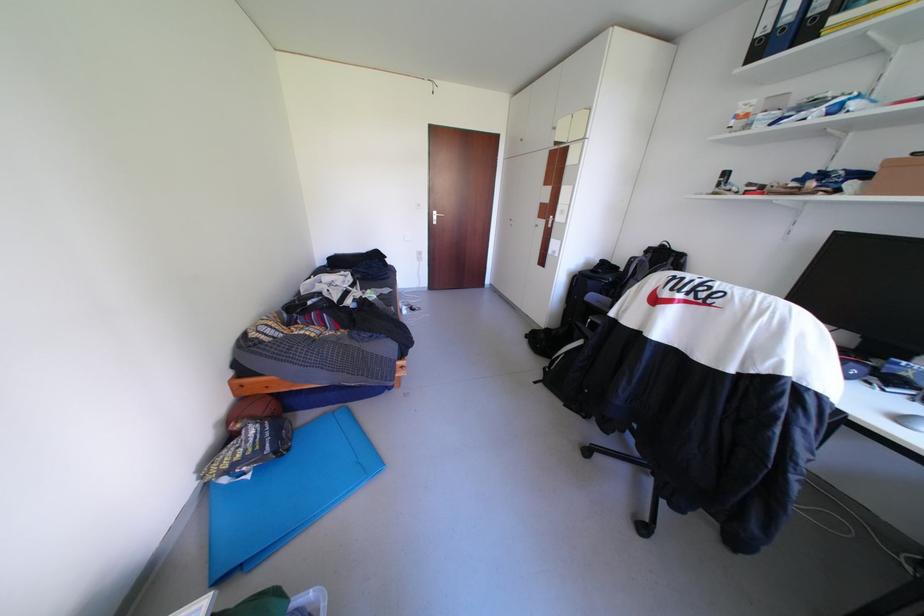
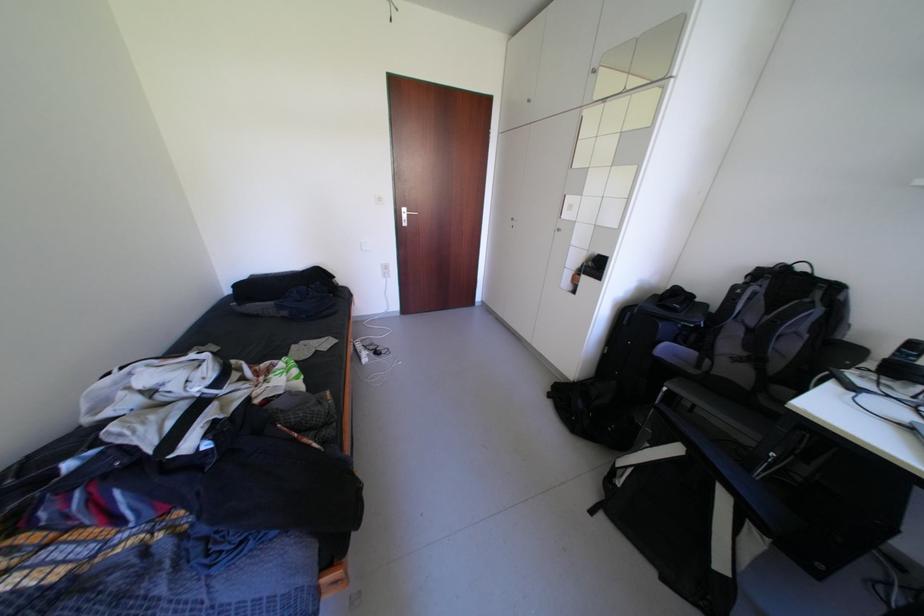
Question: The first image is from the beginning of the video and the second image is from the end. How did the camera likely rotate when shooting the video?

Choices:
 (A) Left
 (B) Right
 (C) Up
 (D) Down

Answer: (B)